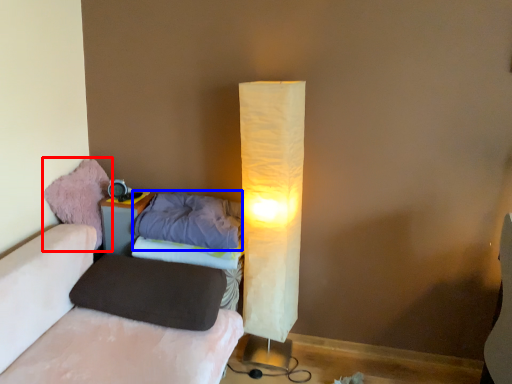
Question: Which of the following is the closest to the observer, bean bag chair (highlighted by a red box) or pillow (highlighted by a blue box)?

Choices:
 (A) bean bag chair
 (B) pillow

Answer: (B)